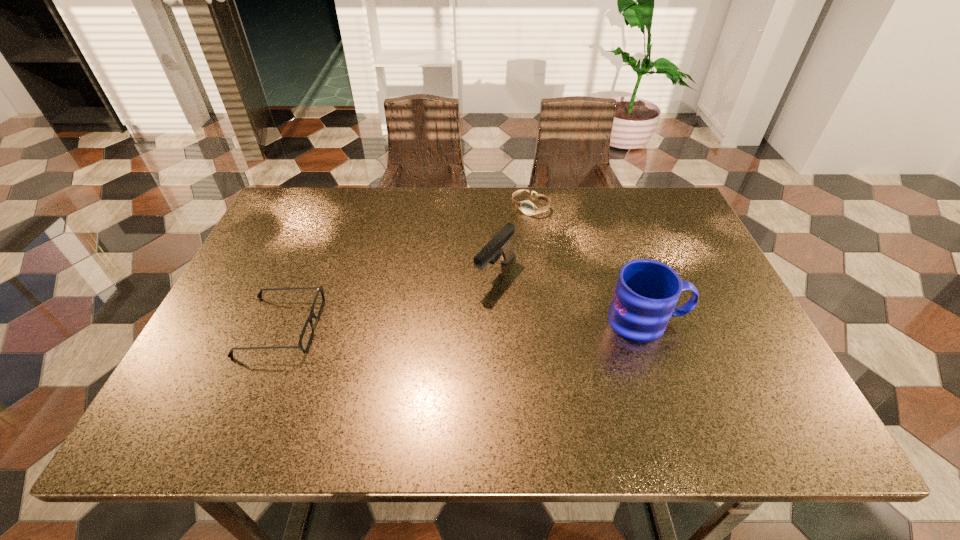
Where is `vacant space in between the tallest object and the third object from left to right`? vacant space in between the tallest object and the third object from left to right is located at coordinates (588, 264).

You are a GUI agent. You are given a task and a screenshot of the screen. Output one action in this format:
    pyautogui.click(x=<x>, y=<y>)
    Task: Click on the free space between the mug and the second farthest object
    The image size is (960, 540).
    Given the screenshot: What is the action you would take?
    pyautogui.click(x=571, y=297)

Locate an element on the screen. free space that is in between the second object from right to left and the mug is located at coordinates (588, 264).

Where is `free space between the leftmost object and the tallest object`? This screenshot has height=540, width=960. free space between the leftmost object and the tallest object is located at coordinates (464, 323).

I want to click on free spot between the second tallest object and the leftmost object, so click(388, 300).

You are a GUI agent. You are given a task and a screenshot of the screen. Output one action in this format:
    pyautogui.click(x=<x>, y=<y>)
    Task: Click on the free space that is in between the pistol and the leftmost object
    The width and height of the screenshot is (960, 540).
    Given the screenshot: What is the action you would take?
    pyautogui.click(x=388, y=300)

At what (x,y) coordinates should I click in order to perform the action: click on vacant region between the farthest object and the rightmost object. Please return your answer as a coordinate pair (x, y). Looking at the image, I should click on (588, 264).

Find the location of `object that is the nearest to the watch`. object that is the nearest to the watch is located at coordinates pos(499,246).

Where is `object that is the closest to the farthest object`? object that is the closest to the farthest object is located at coordinates (499, 246).

The height and width of the screenshot is (540, 960). What are the coordinates of `vacant position in the image that satisfies the following two spatial constraints: 1. on the front side of the third object from right to left; 2. on the side with the handle of the rightmost object` in the screenshot? It's located at (496, 321).